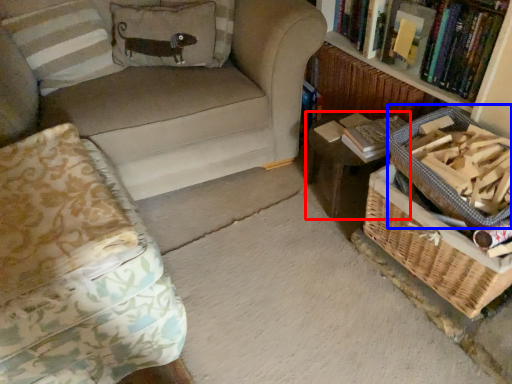
Question: Which point is closer to the camera, table (highlighted by a red box) or basket (highlighted by a blue box)?

Choices:
 (A) table
 (B) basket

Answer: (B)